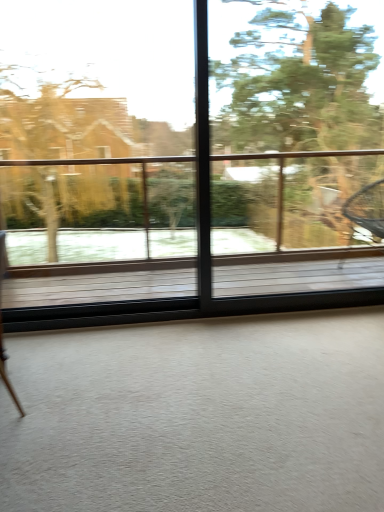
Question: Considering the relative sizes of green leafy tree at upper right and transparent glass window at center in the image provided, is green leafy tree at upper right bigger than transparent glass window at center?

Choices:
 (A) no
 (B) yes

Answer: (B)

Question: Can you confirm if green leafy tree at upper right is wider than transparent glass window at center?

Choices:
 (A) yes
 (B) no

Answer: (A)

Question: Considering the relative positions of green leafy tree at upper right and transparent glass window at center in the image provided, is green leafy tree at upper right behind transparent glass window at center?

Choices:
 (A) yes
 (B) no

Answer: (A)

Question: Is green leafy tree at upper right looking in the opposite direction of transparent glass window at center?

Choices:
 (A) yes
 (B) no

Answer: (A)

Question: From a real-world perspective, is green leafy tree at upper right on top of transparent glass window at center?

Choices:
 (A) no
 (B) yes

Answer: (B)

Question: Is green leafy tree at upper right not inside transparent glass window at center?

Choices:
 (A) no
 (B) yes

Answer: (A)

Question: Could you tell me if transparent glass window at center is facing green leafy tree at upper right?

Choices:
 (A) no
 (B) yes

Answer: (B)

Question: From the image's perspective, does transparent glass window at center appear higher than green leafy tree at upper right?

Choices:
 (A) yes
 (B) no

Answer: (B)

Question: Can we say transparent glass window at center lies outside green leafy tree at upper right?

Choices:
 (A) yes
 (B) no

Answer: (B)

Question: Can you confirm if transparent glass window at center is positioned to the left of green leafy tree at upper right?

Choices:
 (A) no
 (B) yes

Answer: (B)

Question: Does transparent glass window at center have a smaller size compared to green leafy tree at upper right?

Choices:
 (A) no
 (B) yes

Answer: (B)

Question: Considering the relative sizes of transparent glass window at center and green leafy tree at upper right in the image provided, is transparent glass window at center taller than green leafy tree at upper right?

Choices:
 (A) yes
 (B) no

Answer: (A)

Question: Choose the correct answer: Is transparent glass window at center inside green leafy tree at upper right or outside it?

Choices:
 (A) inside
 (B) outside

Answer: (A)